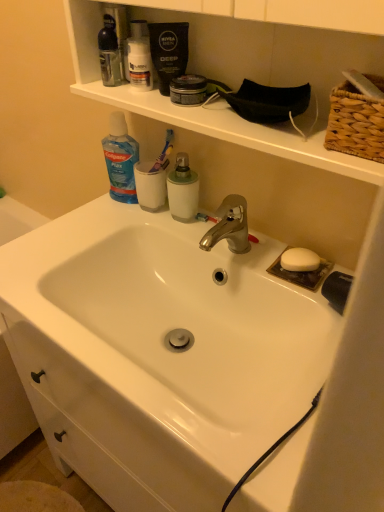
What are the coordinates of `matte plastic shaving cream canister at upper center` in the screenshot? It's located at (139, 56).

How much space does purple plastic toothbrush at upper center, positioned as the 2th toothbrush in bottom-to-top order, occupy vertically?

5.06 inches.

The image size is (384, 512). I want to click on woven straw basket at upper right, so click(x=355, y=124).

Locate an element on the screen. The image size is (384, 512). matte plastic shaving cream canister at upper center is located at coordinates pyautogui.click(x=139, y=56).

In the scene shown: From a real-world perspective, which is physically above, white matte mouthwash at center, which appears as the first mouthwash when ordered from the bottom, or woven straw basket at upper right?

woven straw basket at upper right is physically above.

In terms of height, does white matte mouthwash at center, which appears as the first mouthwash when ordered from the bottom, look taller or shorter compared to woven straw basket at upper right?

white matte mouthwash at center, which appears as the first mouthwash when ordered from the bottom, is taller than woven straw basket at upper right.

Is white matte mouthwash at center, which is the second mouthwash from left to right, in contact with woven straw basket at upper right?

white matte mouthwash at center, which is the second mouthwash from left to right, is not next to woven straw basket at upper right, and they're not touching.

Consider the image. Can we say white matte mouthwash at center, which appears as the first mouthwash when ordered from the bottom, lies outside woven straw basket at upper right?

white matte mouthwash at center, which appears as the first mouthwash when ordered from the bottom, is positioned outside woven straw basket at upper right.

Can you confirm if translucent plastic mouthwash at upper left, which is the 2th mouthwash from bottom to top, is smaller than woven straw basket at upper right?

Indeed, translucent plastic mouthwash at upper left, which is the 2th mouthwash from bottom to top, has a smaller size compared to woven straw basket at upper right.

I want to click on basket on the right of translucent plastic mouthwash at upper left, the first mouthwash positioned from the top, so click(x=355, y=124).

Which is behind, point (107, 71) or point (332, 106)?

The point (107, 71) is farther.

Is translucent plastic mouthwash at upper left, arranged as the second mouthwash when viewed from the right, not near woven straw basket at upper right?

No, translucent plastic mouthwash at upper left, arranged as the second mouthwash when viewed from the right, is in close proximity to woven straw basket at upper right.

Can you confirm if red plastic toothbrush at center, which is the second toothbrush from left to right, is shorter than purple plastic toothbrush at upper center, which is the first toothbrush in left-to-right order?

Indeed, red plastic toothbrush at center, which is the second toothbrush from left to right, has a lesser height compared to purple plastic toothbrush at upper center, which is the first toothbrush in left-to-right order.

Can you confirm if red plastic toothbrush at center, positioned as the 1th toothbrush in right-to-left order, is positioned to the left of purple plastic toothbrush at upper center, which is the first toothbrush in left-to-right order?

Incorrect, red plastic toothbrush at center, positioned as the 1th toothbrush in right-to-left order, is not on the left side of purple plastic toothbrush at upper center, which is the first toothbrush in left-to-right order.

In the image, is red plastic toothbrush at center, positioned as the 1th toothbrush in right-to-left order, positioned in front of or behind purple plastic toothbrush at upper center, the second toothbrush from the right?

Clearly, red plastic toothbrush at center, positioned as the 1th toothbrush in right-to-left order, is in front of purple plastic toothbrush at upper center, the second toothbrush from the right.

Does red plastic toothbrush at center, positioned as the 1th toothbrush in right-to-left order, appear on the right side of blue translucent liquid at upper left?

Yes.

Considering the sizes of objects red plastic toothbrush at center, the first toothbrush ordered from the bottom, and blue translucent liquid at upper left in the image provided, who is smaller, red plastic toothbrush at center, the first toothbrush ordered from the bottom, or blue translucent liquid at upper left?

red plastic toothbrush at center, the first toothbrush ordered from the bottom.

Is red plastic toothbrush at center, positioned as the 1th toothbrush in right-to-left order, inside or outside of blue translucent liquid at upper left?

red plastic toothbrush at center, positioned as the 1th toothbrush in right-to-left order, is not enclosed by blue translucent liquid at upper left.

Find the location of a particular element. The image size is (384, 512). sink on the right of purple plastic toothbrush at upper center, the second toothbrush from the right is located at coordinates (187, 329).

How many degrees apart are the facing directions of purple plastic toothbrush at upper center, positioned as the 2th toothbrush in bottom-to-top order, and white glossy sink at center?

purple plastic toothbrush at upper center, positioned as the 2th toothbrush in bottom-to-top order, and white glossy sink at center are facing 1.79 degrees away from each other.

Can you confirm if purple plastic toothbrush at upper center, placed as the first toothbrush when sorted from top to bottom, is smaller than white glossy sink at center?

Correct, purple plastic toothbrush at upper center, placed as the first toothbrush when sorted from top to bottom, occupies less space than white glossy sink at center.

Which of these two, purple plastic toothbrush at upper center, placed as the first toothbrush when sorted from top to bottom, or white glossy sink at center, is wider?

white glossy sink at center is wider.

Which of these two, blue translucent liquid at upper left or white matte mouthwash at center, the first mouthwash from the right, stands taller?

blue translucent liquid at upper left is taller.

Is blue translucent liquid at upper left not close to white matte mouthwash at center, placed as the 2th mouthwash when sorted from top to bottom?

They are positioned close to each other.

From the picture: From the image's perspective, relative to white matte mouthwash at center, which appears as the first mouthwash when ordered from the bottom, is blue translucent liquid at upper left above or below?

blue translucent liquid at upper left is above white matte mouthwash at center, which appears as the first mouthwash when ordered from the bottom.

Is blue translucent liquid at upper left to the left of white matte mouthwash at center, placed as the 2th mouthwash when sorted from top to bottom, from the viewer's perspective?

Yes.

Could woven straw basket at upper right be considered to be inside red plastic toothbrush at center, which is the second toothbrush from left to right?

Definitely not — woven straw basket at upper right is not inside red plastic toothbrush at center, which is the second toothbrush from left to right.

Is red plastic toothbrush at center, which is the 2th toothbrush from top to bottom, aimed at woven straw basket at upper right?

No, red plastic toothbrush at center, which is the 2th toothbrush from top to bottom, is not turned towards woven straw basket at upper right.

From the image's perspective, is red plastic toothbrush at center, which is the 2th toothbrush from top to bottom, located above or below woven straw basket at upper right?

From the image's perspective, red plastic toothbrush at center, which is the 2th toothbrush from top to bottom, appears below woven straw basket at upper right.

Is the surface of red plastic toothbrush at center, the first toothbrush ordered from the bottom, in direct contact with woven straw basket at upper right?

No, red plastic toothbrush at center, the first toothbrush ordered from the bottom, is not with woven straw basket at upper right.

You are a GUI agent. You are given a task and a screenshot of the screen. Output one action in this format:
    pyautogui.click(x=<x>, y=<y>)
    Task: Click on the mouthwash that appears below the woven straw basket at upper right (from the image's perspective)
    
    Given the screenshot: What is the action you would take?
    pyautogui.click(x=183, y=190)

Where is `the 2nd mouthwash to the left when counting from the woven straw basket at upper right`? The height and width of the screenshot is (512, 384). the 2nd mouthwash to the left when counting from the woven straw basket at upper right is located at coordinates (109, 53).

From the image, which object appears to be farther from translucent plastic mouthwash at upper left, arranged as the second mouthwash when viewed from the right, white matte mouthwash at center, placed as the 2th mouthwash when sorted from top to bottom, or matte plastic shaving cream canister at upper center?

white matte mouthwash at center, placed as the 2th mouthwash when sorted from top to bottom.

Considering their positions, is woven straw basket at upper right positioned closer to blue translucent liquid at upper left than white matte mouthwash at center, the first mouthwash from the right?

Based on the image, white matte mouthwash at center, the first mouthwash from the right, appears to be nearer to blue translucent liquid at upper left.

Based on their spatial positions, is white matte mouthwash at center, the first mouthwash from the right, or purple plastic toothbrush at upper center, positioned as the 2th toothbrush in bottom-to-top order, further from white glossy sink at center?

purple plastic toothbrush at upper center, positioned as the 2th toothbrush in bottom-to-top order, is further to white glossy sink at center.

Considering their positions, is purple plastic toothbrush at upper center, placed as the first toothbrush when sorted from top to bottom, positioned closer to matte plastic shaving cream canister at upper center than woven straw basket at upper right?

purple plastic toothbrush at upper center, placed as the first toothbrush when sorted from top to bottom, is closer to matte plastic shaving cream canister at upper center.

Looking at the image, which one is located closer to red plastic toothbrush at center, which is the second toothbrush from left to right, purple plastic toothbrush at upper center, placed as the first toothbrush when sorted from top to bottom, or white glossy sink at center?

The object closer to red plastic toothbrush at center, which is the second toothbrush from left to right, is purple plastic toothbrush at upper center, placed as the first toothbrush when sorted from top to bottom.

Considering their positions, is white glossy sink at center positioned further to woven straw basket at upper right than blue translucent liquid at upper left?

blue translucent liquid at upper left.

Based on their spatial positions, is blue translucent liquid at upper left or red plastic toothbrush at center, positioned as the 1th toothbrush in right-to-left order, closer to white glossy sink at center?

red plastic toothbrush at center, positioned as the 1th toothbrush in right-to-left order, is closer to white glossy sink at center.

Which object lies nearer to the anchor point white matte mouthwash at center, the first mouthwash from the right, woven straw basket at upper right or translucent plastic mouthwash at upper left, the first mouthwash positioned from the top?

translucent plastic mouthwash at upper left, the first mouthwash positioned from the top, lies closer to white matte mouthwash at center, the first mouthwash from the right, than the other object.

This screenshot has height=512, width=384. I want to click on basket between matte plastic shaving cream canister at upper center and white glossy sink at center vertically, so click(x=355, y=124).

Where is `toothbrush that lies between matte plastic shaving cream canister at upper center and white matte mouthwash at center, which appears as the first mouthwash when ordered from the bottom, from top to bottom`? toothbrush that lies between matte plastic shaving cream canister at upper center and white matte mouthwash at center, which appears as the first mouthwash when ordered from the bottom, from top to bottom is located at coordinates (164, 153).

This screenshot has width=384, height=512. What are the coordinates of `toothbrush between translucent plastic mouthwash at upper left, positioned as the first mouthwash in left-to-right order, and blue translucent liquid at upper left vertically` in the screenshot? It's located at (164, 153).

The image size is (384, 512). In order to click on cleaning product between woven straw basket at upper right and purple plastic toothbrush at upper center, placed as the first toothbrush when sorted from top to bottom, in the front-back direction in this screenshot , I will do `click(120, 159)`.